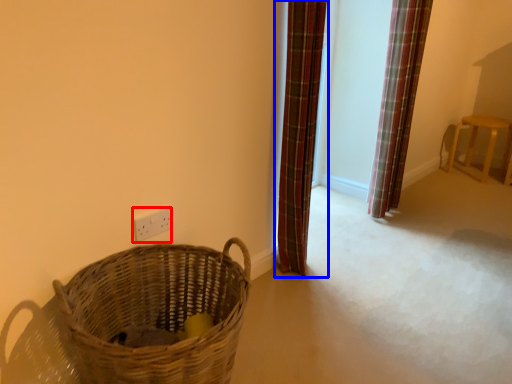
Question: Which of the following is the farthest to the observer, electric outlet (highlighted by a red box) or curtain (highlighted by a blue box)?

Choices:
 (A) electric outlet
 (B) curtain

Answer: (B)